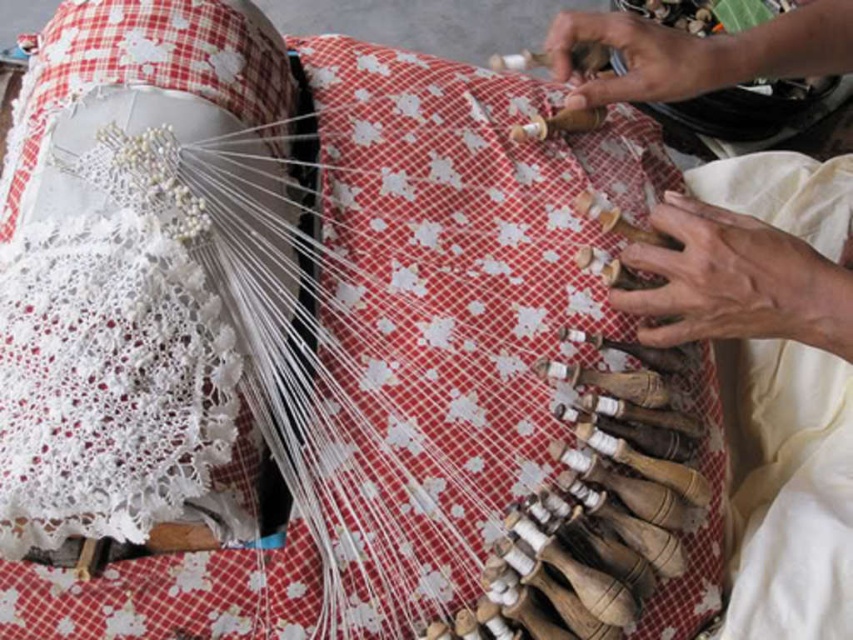
Which of these two, dry skin at center or smooth skin hand at upper right, stands taller?

dry skin at center is taller.

Where is `dry skin at center`? dry skin at center is located at coordinates (735, 282).